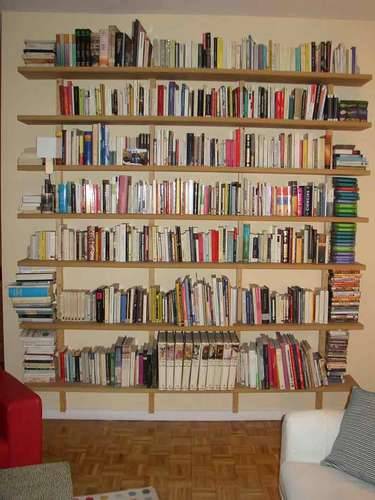
Locate an element on the screen. floor is located at coordinates (182, 451).